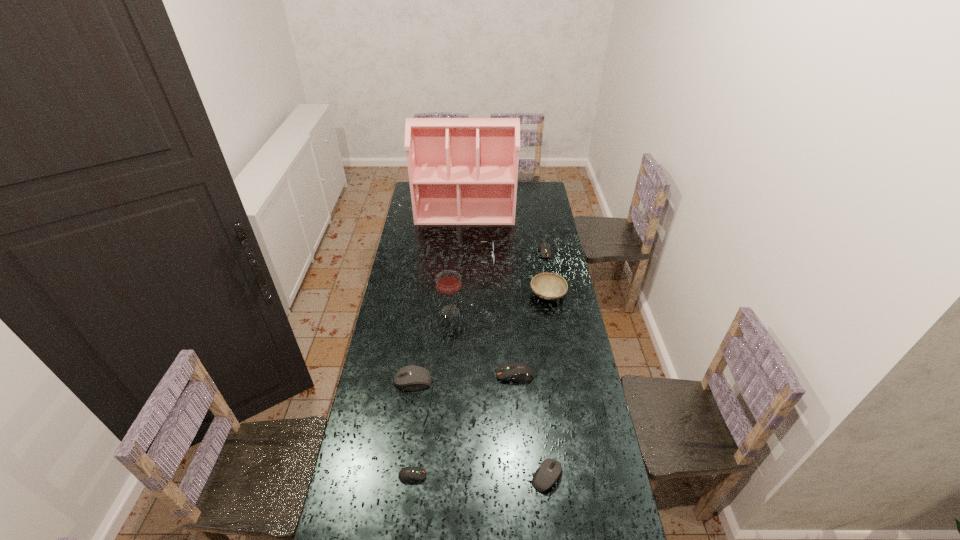
Locate which dark computer equipment ranks second in proximity to the spectacles. Please provide its 2D coordinates. Your answer should be formatted as a tuple, i.e. [(x, y)], where the tuple contains the x and y coordinates of a point satisfying the conditions above.

[(518, 372)]

This screenshot has height=540, width=960. What are the coordinates of `the second closest black computer equipment to the gray bowl` in the screenshot? It's located at (550, 470).

Identify the location of vacant region that satisfies the following two spatial constraints: 1. on the lenses of the spectacles; 2. on the left side of the bowl. This screenshot has width=960, height=540. (477, 295).

Where is `free location that satisfies the following two spatial constraints: 1. on the button of the rightmost dark computer equipment; 2. on the lenses of the spectacles`? This screenshot has width=960, height=540. free location that satisfies the following two spatial constraints: 1. on the button of the rightmost dark computer equipment; 2. on the lenses of the spectacles is located at coordinates (545, 258).

Where is `vacant space that satisfies the following two spatial constraints: 1. on the button of the right black computer equipment; 2. on the left side of the leftmost dark computer equipment`? The image size is (960, 540). vacant space that satisfies the following two spatial constraints: 1. on the button of the right black computer equipment; 2. on the left side of the leftmost dark computer equipment is located at coordinates coord(412,476).

The height and width of the screenshot is (540, 960). Identify the location of vacant area in the image that satisfies the following two spatial constraints: 1. on the button of the smaller black computer equipment; 2. on the left side of the second dark computer equipment from right to left. (523, 476).